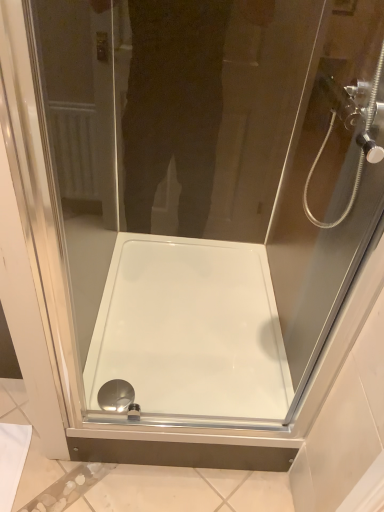
Question: Is transparent glass shower head at upper right aimed at white glossy bath at center?

Choices:
 (A) no
 (B) yes

Answer: (A)

Question: From a real-world perspective, does transparent glass shower head at upper right stand above white glossy bath at center?

Choices:
 (A) no
 (B) yes

Answer: (B)

Question: Is transparent glass shower head at upper right far from white glossy bath at center?

Choices:
 (A) yes
 (B) no

Answer: (B)

Question: Considering the relative sizes of transparent glass shower head at upper right and white glossy bath at center in the image provided, is transparent glass shower head at upper right shorter than white glossy bath at center?

Choices:
 (A) no
 (B) yes

Answer: (A)

Question: Considering the relative sizes of transparent glass shower head at upper right and white glossy bath at center in the image provided, is transparent glass shower head at upper right thinner than white glossy bath at center?

Choices:
 (A) no
 (B) yes

Answer: (B)

Question: Does point (91, 338) appear closer or farther from the camera than point (365, 7)?

Choices:
 (A) farther
 (B) closer

Answer: (A)

Question: Considering the positions of white glossy bath at center and transparent glass shower head at upper right in the image, is white glossy bath at center taller or shorter than transparent glass shower head at upper right?

Choices:
 (A) tall
 (B) short

Answer: (B)

Question: Relative to transparent glass shower head at upper right, is white glossy bath at center in front or behind?

Choices:
 (A) behind
 (B) front

Answer: (A)

Question: Based on their positions, is white glossy bath at center located to the left or right of transparent glass shower head at upper right?

Choices:
 (A) left
 (B) right

Answer: (A)

Question: Based on their sizes in the image, would you say polished chrome drain at bottom center is bigger or smaller than white glossy bath at center?

Choices:
 (A) small
 (B) big

Answer: (A)

Question: Considering the positions of polished chrome drain at bottom center and white glossy bath at center in the image, is polished chrome drain at bottom center wider or thinner than white glossy bath at center?

Choices:
 (A) wide
 (B) thin

Answer: (B)

Question: From a real-world perspective, relative to white glossy bath at center, is polished chrome drain at bottom center vertically above or below?

Choices:
 (A) below
 (B) above

Answer: (B)

Question: Considering the positions of point (97, 394) and point (122, 297), is point (97, 394) closer or farther from the camera than point (122, 297)?

Choices:
 (A) closer
 (B) farther

Answer: (A)

Question: Looking at the image, does transparent glass shower head at upper right seem bigger or smaller compared to white glossy bath at center?

Choices:
 (A) big
 (B) small

Answer: (B)

Question: In the image, is transparent glass shower head at upper right positioned in front of or behind white glossy bath at center?

Choices:
 (A) front
 (B) behind

Answer: (A)